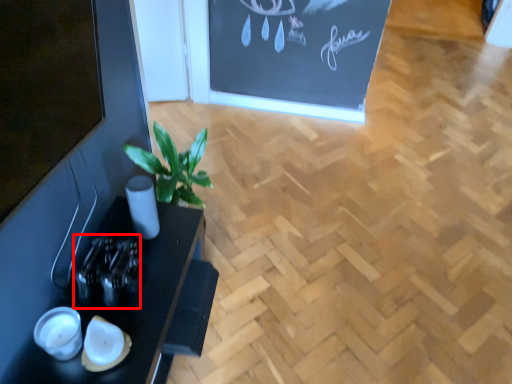
Question: From the image's perspective, where is bottle (annotated by the red box) located in relation to table in the image?

Choices:
 (A) above
 (B) below

Answer: (A)